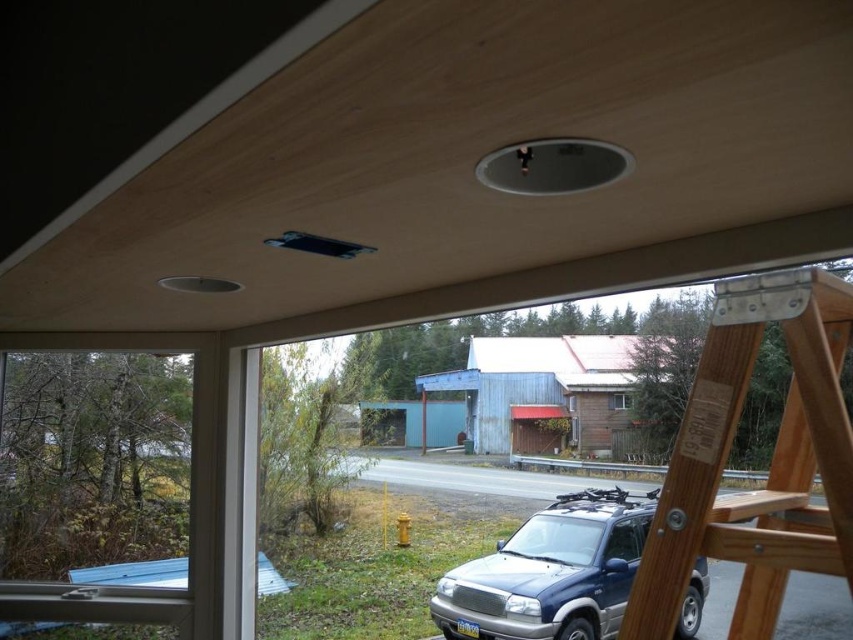
Question: In this image, where is metallic blue suv at lower right located relative to brown wooden window at center?

Choices:
 (A) below
 (B) above

Answer: (A)

Question: Is clear glass window at left in front of brown wooden window at center?

Choices:
 (A) yes
 (B) no

Answer: (A)

Question: Which point is closer to the camera taking this photo?

Choices:
 (A) (4, 456)
 (B) (612, 397)
 (C) (795, 332)

Answer: (C)

Question: Estimate the real-world distances between objects in this image. Which object is farther from the wooden ladder at right?

Choices:
 (A) metallic blue suv at lower right
 (B) clear glass window at left
 (C) brown wooden window at center

Answer: (C)

Question: Does clear glass window at left have a smaller size compared to metallic blue suv at lower right?

Choices:
 (A) yes
 (B) no

Answer: (A)

Question: Which point is closer to the camera?

Choices:
 (A) (599, 609)
 (B) (186, 573)

Answer: (B)